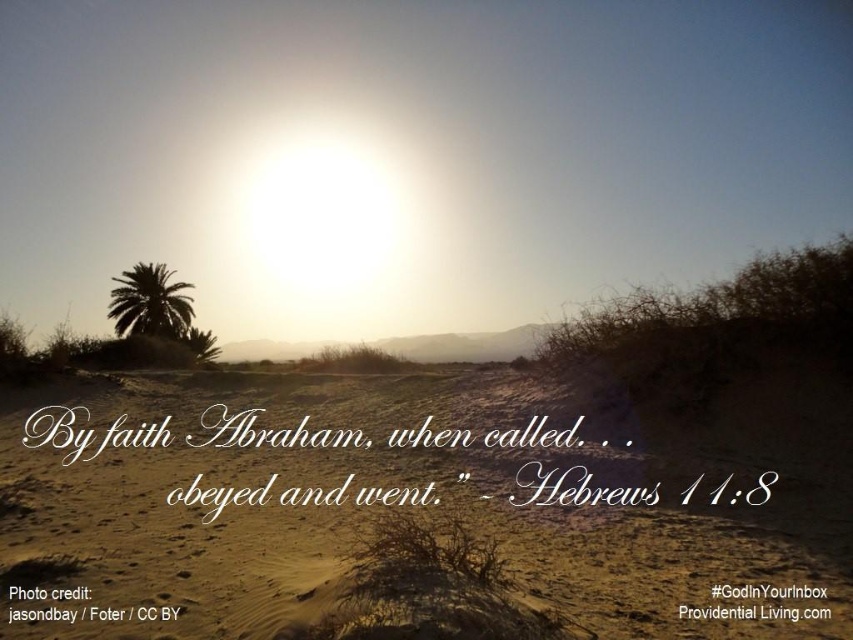
Can you confirm if sandy beige desert at center is bigger than silhouette palm tree at left?

Incorrect, sandy beige desert at center is not larger than silhouette palm tree at left.

Measure the distance between point (322, 568) and camera.

Point (322, 568) and camera are 120.76 meters apart.

Does point (254, 586) come closer to viewer compared to point (154, 300)?

Yes, it is.

Where is `sandy beige desert at center`? sandy beige desert at center is located at coordinates (366, 513).